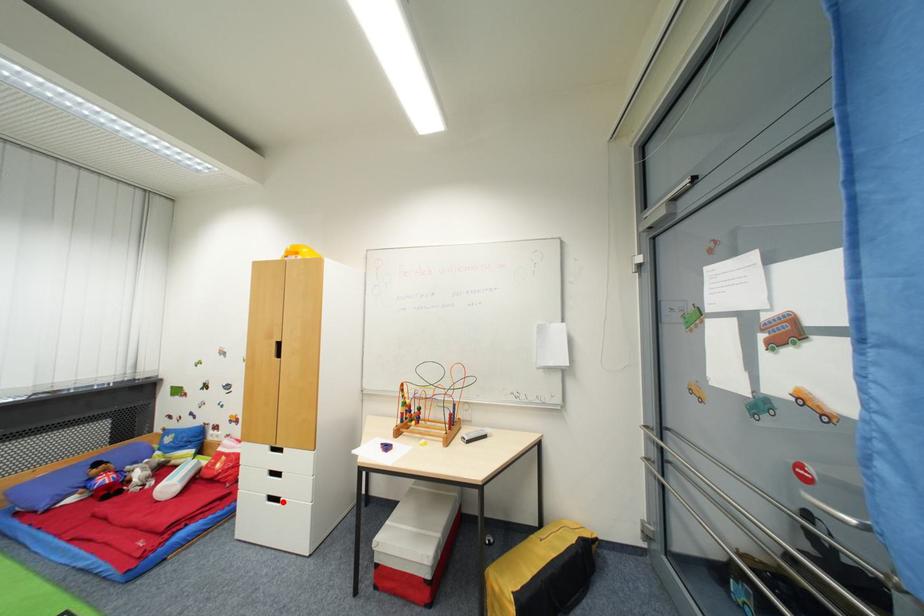
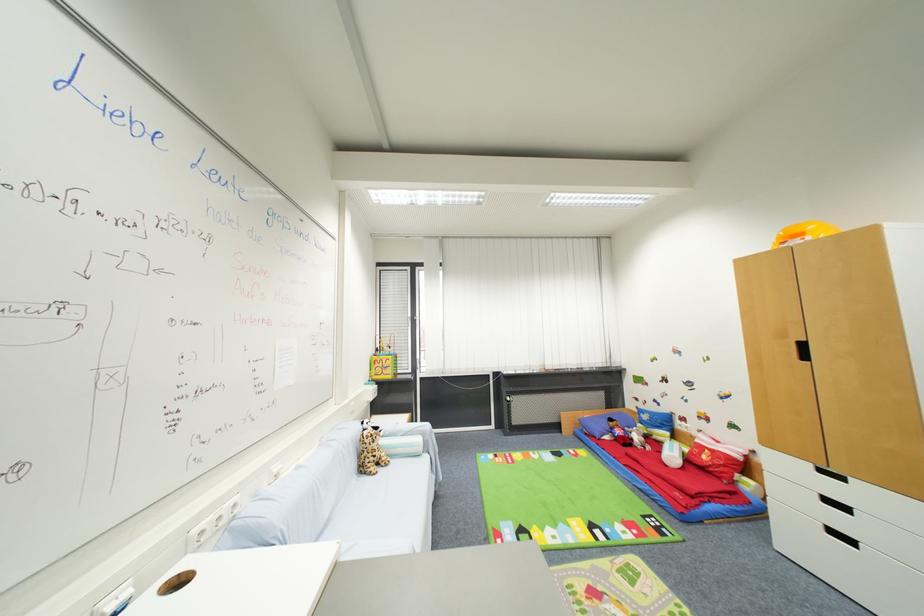
Question: I am providing you with two images of the same scene from different viewpoints. In image1, a red point is highlighted. Considering the same 3D point in image2, which of the following is correct?

Choices:
 (A) It is closer
 (B) It is farther

Answer: (A)